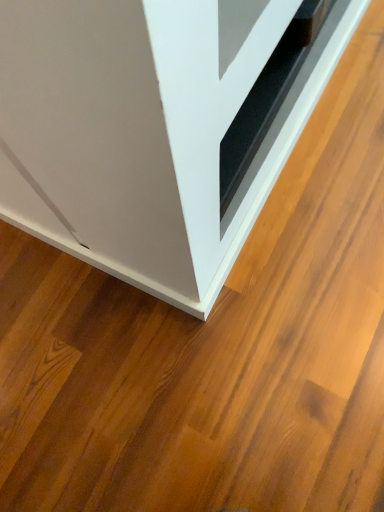
What do you see at coordinates (147, 130) in the screenshot? I see `white glossy cabinet at lower left` at bounding box center [147, 130].

Where is `white glossy cabinet at lower left`? The width and height of the screenshot is (384, 512). white glossy cabinet at lower left is located at coordinates (147, 130).

The image size is (384, 512). I want to click on white glossy cabinet at lower left, so click(147, 130).